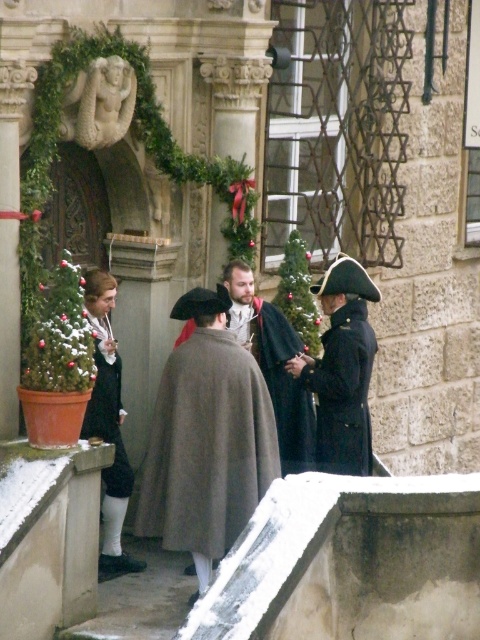
Question: Based on their relative distances, which object is nearer to the gray woolen cloak at center?

Choices:
 (A) brown woolen cape at center
 (B) dark blue wool coat at center

Answer: (B)

Question: Is brown woolen cape at center wider than dark gray woolen robe at center?

Choices:
 (A) no
 (B) yes

Answer: (B)

Question: Which point appears farthest from the camera in this image?

Choices:
 (A) (103, 364)
 (B) (334, 433)

Answer: (B)

Question: Does gray woolen cloak at center appear on the right side of brown woolen cape at center?

Choices:
 (A) no
 (B) yes

Answer: (A)

Question: Can you confirm if brown woolen cape at center is thinner than dark gray woolen robe at center?

Choices:
 (A) no
 (B) yes

Answer: (A)

Question: Which point appears closest to the camera in this image?

Choices:
 (A) (351, 419)
 (B) (100, 337)
 (C) (181, 410)
 (D) (180, 332)

Answer: (C)